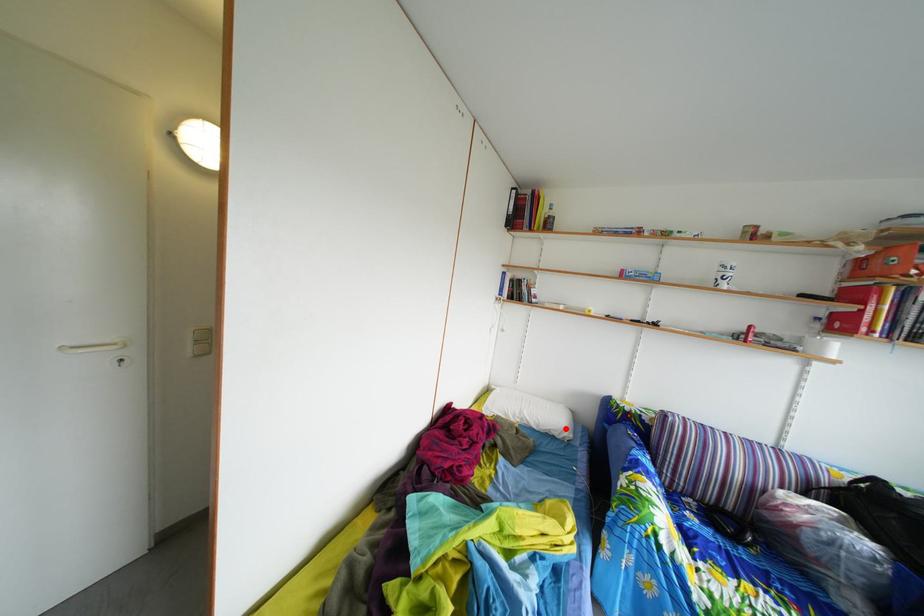
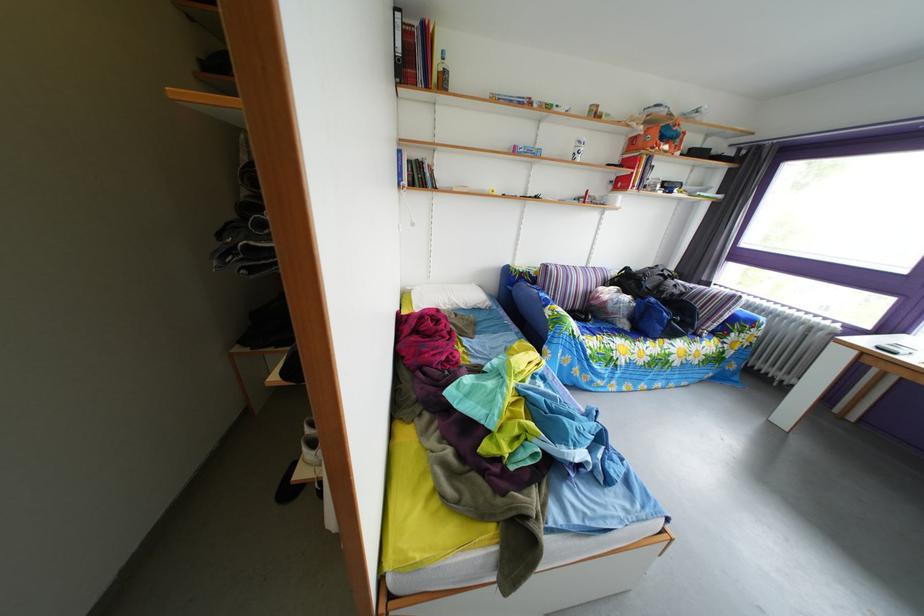
Where in the second image is the point corresponding to the highlighted location from the first image?

(485, 305)